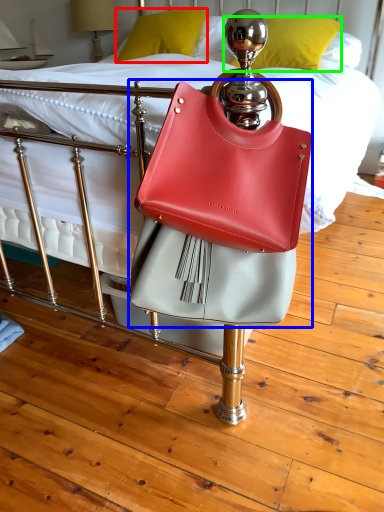
Question: Which is farther away from pillow (highlighted by a red box)? handbag (highlighted by a blue box) or pillow (highlighted by a green box)?

Choices:
 (A) handbag
 (B) pillow

Answer: (A)